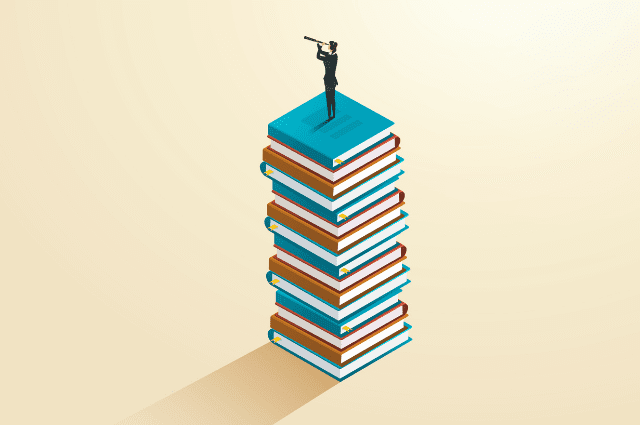
Find the location of `brown cover book`. brown cover book is located at coordinates (320, 345), (320, 293), (312, 237), (315, 186).